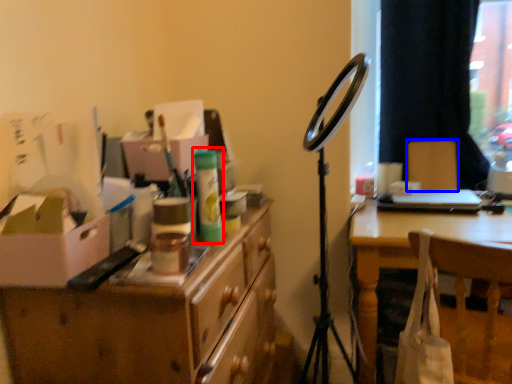
Question: Among these objects, which one is nearest to the camera, toiletry (highlighted by a red box) or armchair (highlighted by a blue box)?

Choices:
 (A) toiletry
 (B) armchair

Answer: (A)